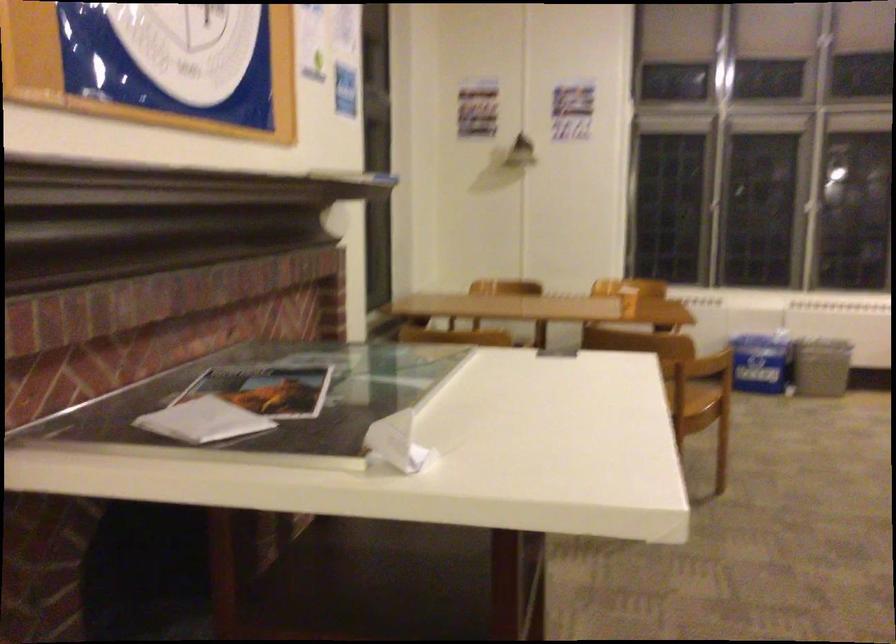
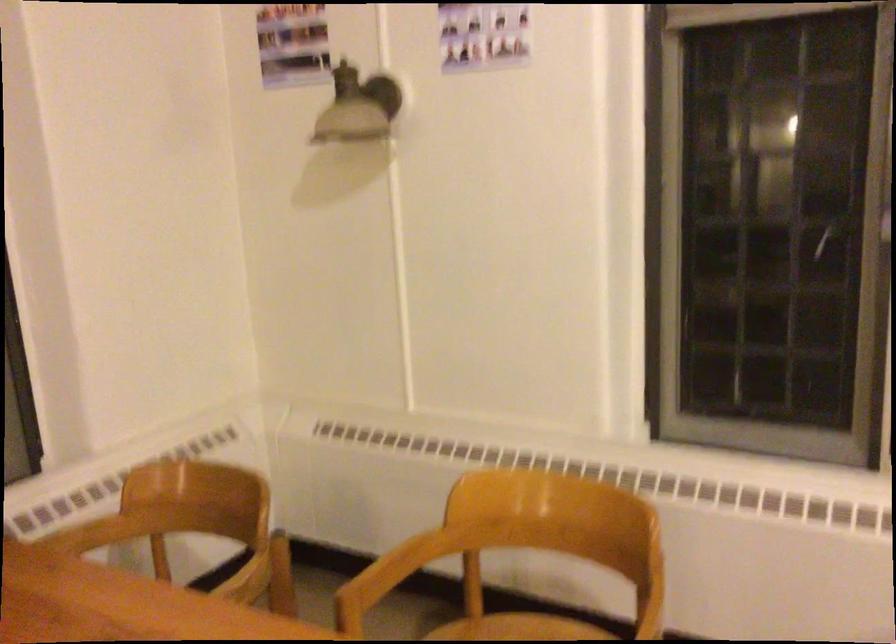
Question: What movement of the cameraman would produce the second image?

Choices:
 (A) Left
 (B) Right
 (C) Forward
 (D) Backward

Answer: (C)